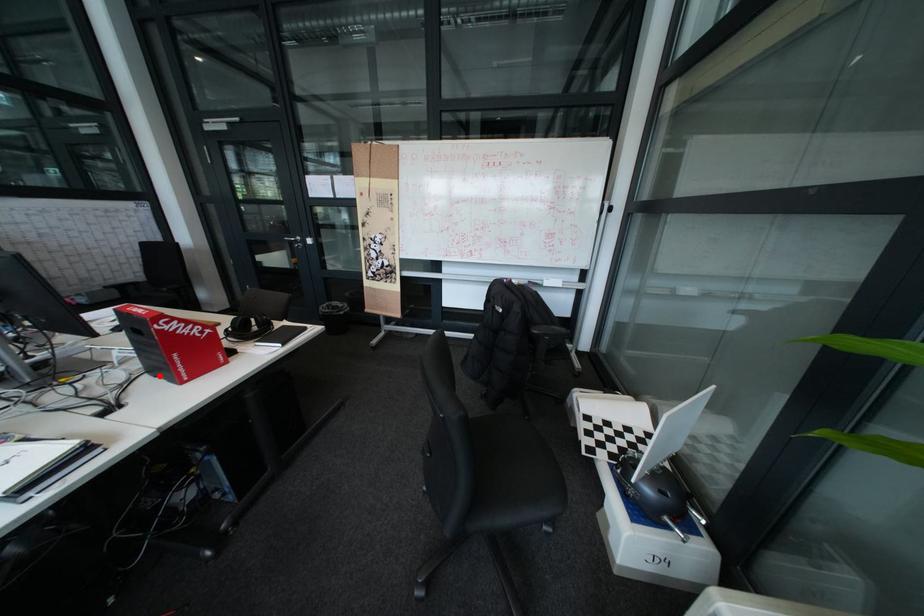
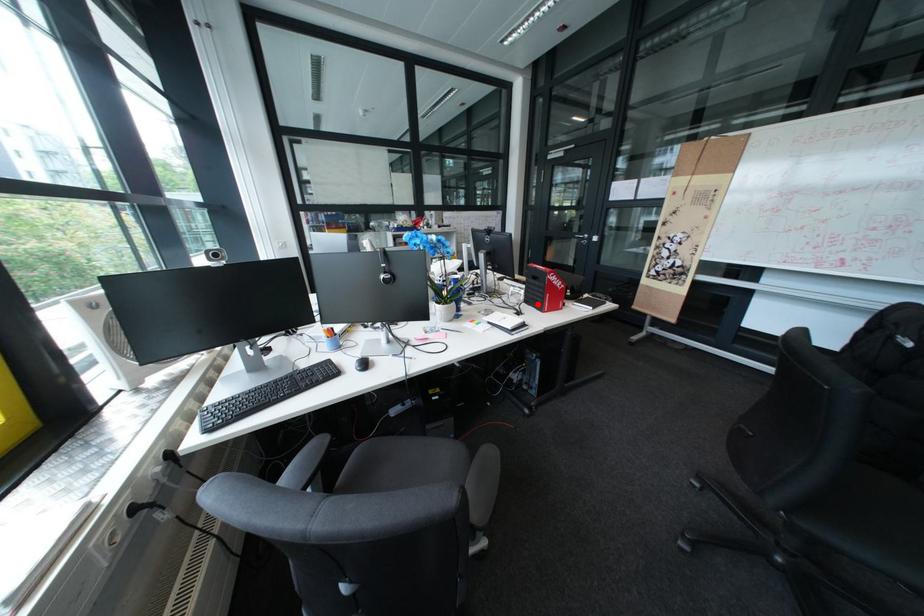
I am providing you with two images of the same scene from different viewpoints. A red point is marked on the first image and another point is marked on the second image. Is the red point in image1 aligned with the point shown in image2?

Yes